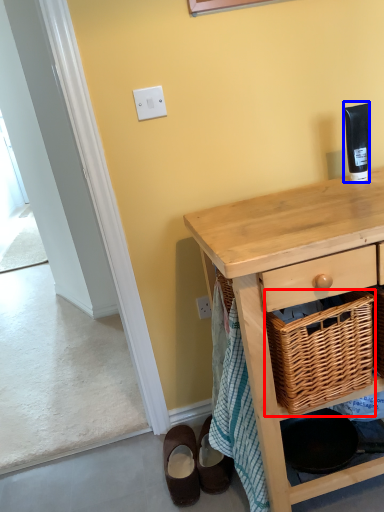
Question: Which object appears closest to the camera in this image, picnic basket (highlighted by a red box) or toiletry (highlighted by a blue box)?

Choices:
 (A) picnic basket
 (B) toiletry

Answer: (A)